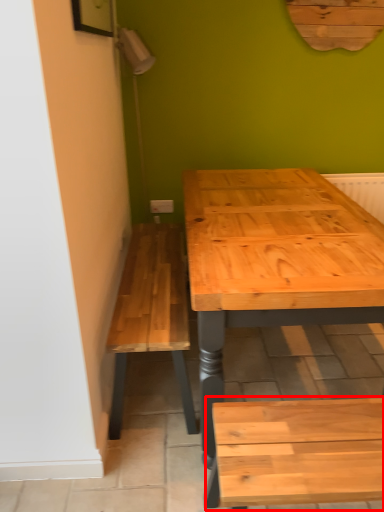
Question: From the image, what is the correct spatial relationship of church bench (annotated by the red box) in relation to electric outlet?

Choices:
 (A) left
 (B) right

Answer: (B)